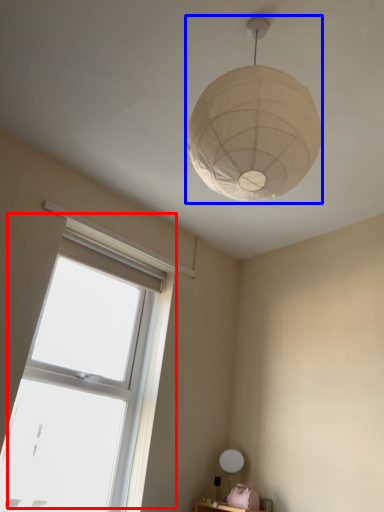
Question: Which of the following is the closest to the observer, window (highlighted by a red box) or lamp (highlighted by a blue box)?

Choices:
 (A) window
 (B) lamp

Answer: (B)